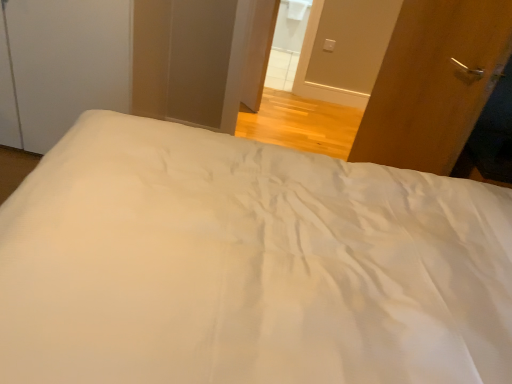
Question: Is white smooth bed at center wider than white glossy door at upper center, which ranks as the second screen door in left-to-right order?

Choices:
 (A) no
 (B) yes

Answer: (B)

Question: Is white smooth bed at center bigger than white glossy door at upper center, which appears as the first screen door when viewed from the right?

Choices:
 (A) no
 (B) yes

Answer: (B)

Question: Is the depth of white smooth bed at center less than that of white glossy door at upper center, which appears as the first screen door when viewed from the right?

Choices:
 (A) no
 (B) yes

Answer: (B)

Question: Does white smooth bed at center appear on the right side of white glossy door at upper center, which ranks as the second screen door in left-to-right order?

Choices:
 (A) no
 (B) yes

Answer: (A)

Question: Are white smooth bed at center and white glossy door at upper center, which ranks as the second screen door in left-to-right order, making contact?

Choices:
 (A) yes
 (B) no

Answer: (B)

Question: Is white smooth bed at center further to the viewer compared to white glossy door at upper center, which appears as the first screen door when viewed from the right?

Choices:
 (A) no
 (B) yes

Answer: (A)

Question: Could wooden door at right be considered to be inside white glossy door at upper center, which ranks as the second screen door in left-to-right order?

Choices:
 (A) no
 (B) yes

Answer: (A)

Question: Considering the relative sizes of white glossy door at upper center, which ranks as the second screen door in left-to-right order, and wooden door at right in the image provided, is white glossy door at upper center, which ranks as the second screen door in left-to-right order, smaller than wooden door at right?

Choices:
 (A) yes
 (B) no

Answer: (A)

Question: Is white glossy door at upper center, which appears as the first screen door when viewed from the right, closer to the viewer compared to wooden door at right?

Choices:
 (A) no
 (B) yes

Answer: (A)

Question: Is white glossy door at upper center, which appears as the first screen door when viewed from the right, shorter than wooden door at right?

Choices:
 (A) no
 (B) yes

Answer: (B)

Question: From a real-world perspective, is white glossy door at upper center, which appears as the first screen door when viewed from the right, positioned over wooden door at right based on gravity?

Choices:
 (A) no
 (B) yes

Answer: (B)

Question: Can you confirm if white glossy door at upper center, which appears as the first screen door when viewed from the right, is positioned to the left of wooden door at right?

Choices:
 (A) yes
 (B) no

Answer: (A)

Question: Can you confirm if wooden door at right is taller than white glossy door at upper center, which ranks as the second screen door in left-to-right order?

Choices:
 (A) no
 (B) yes

Answer: (B)